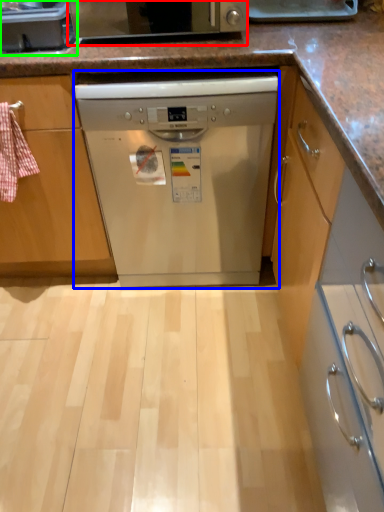
Question: Which object is the farthest from home appliance (highlighted by a red box)? Choose among these: dishwasher (highlighted by a blue box) or kitchen appliance (highlighted by a green box).

Choices:
 (A) dishwasher
 (B) kitchen appliance

Answer: (A)